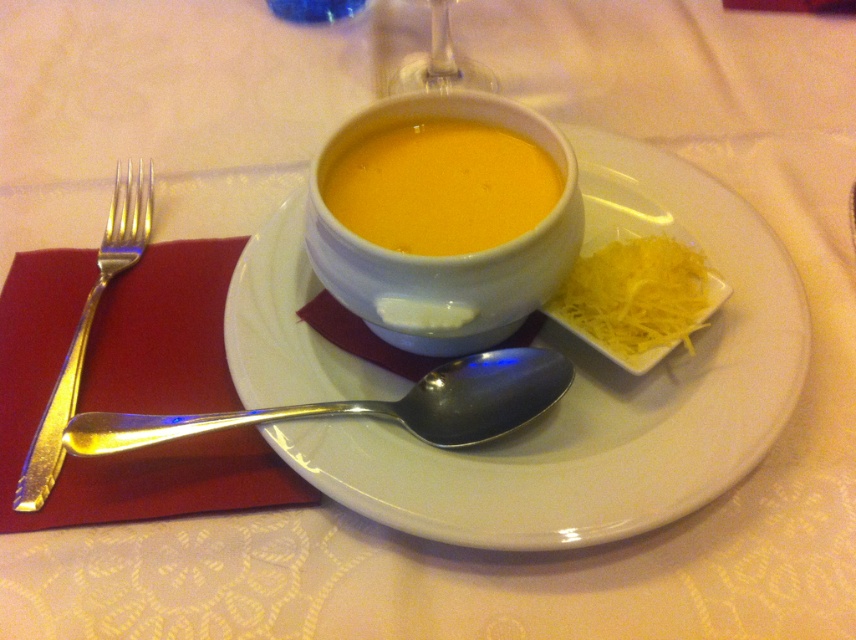
Question: Is yellow shredded cheese at right closer to camera compared to silver metallic fork at left?

Choices:
 (A) yes
 (B) no

Answer: (B)

Question: Is white glossy plate at center in front of silver metallic fork at left?

Choices:
 (A) yes
 (B) no

Answer: (A)

Question: Estimate the real-world distances between objects in this image. Which object is closer to the transparent glass at upper center?

Choices:
 (A) white glossy bowl at center
 (B) white glossy plate at center
 (C) silver metallic fork at left
 (D) yellow shredded cheese at right

Answer: (A)

Question: Which object appears closest to the camera in this image?

Choices:
 (A) silver metallic fork at left
 (B) white glossy bowl at center
 (C) white glossy plate at center
 (D) polished silver spoon at center

Answer: (C)

Question: Which object is the farthest from the white glossy bowl at center?

Choices:
 (A) silver metallic fork at left
 (B) yellow matte soup at center

Answer: (A)

Question: Does yellow shredded cheese at right appear under silver metallic fork at left?

Choices:
 (A) no
 (B) yes

Answer: (A)